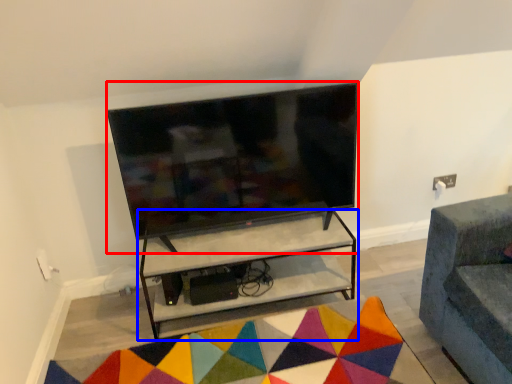
Question: Among these objects, which one is farthest to the camera, television (highlighted by a red box) or shelf (highlighted by a blue box)?

Choices:
 (A) television
 (B) shelf

Answer: (B)